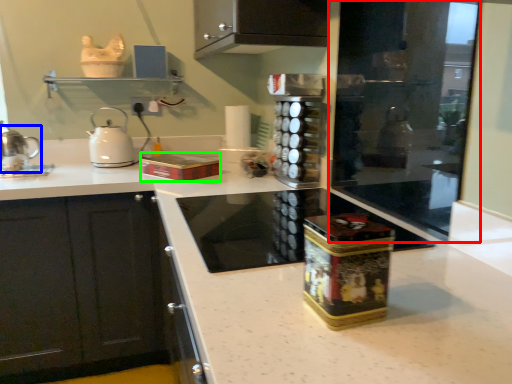
Question: Which object is positioned closest to screen door (highlighted by a red box)? Select from kitchen appliance (highlighted by a blue box) and box (highlighted by a green box).

Choices:
 (A) kitchen appliance
 (B) box

Answer: (B)